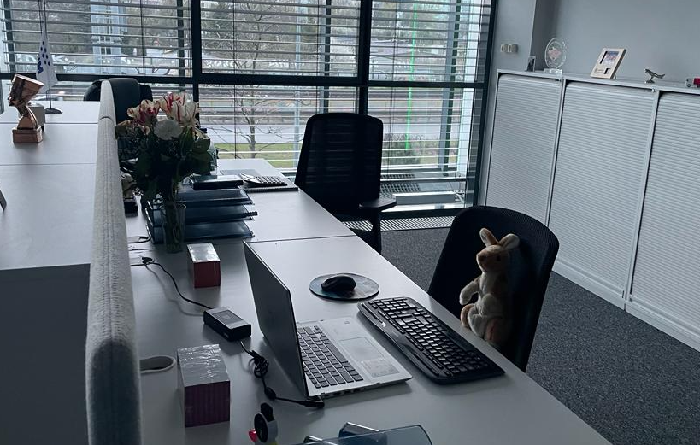
Identify the location of 3 sets of blinds. (262, 31), (116, 57), (447, 50).